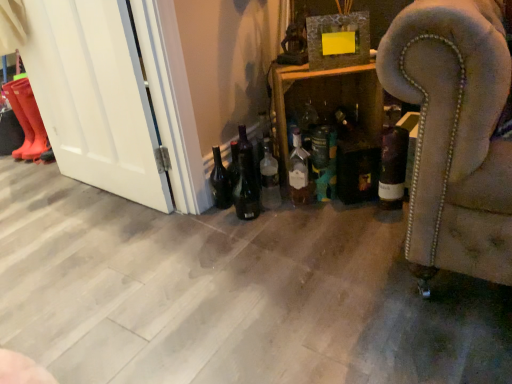
This screenshot has width=512, height=384. In order to click on blank space to the left of matte glass bottle at center, which is counted as the 4th bottle, starting from the right in this screenshot , I will do `click(276, 210)`.